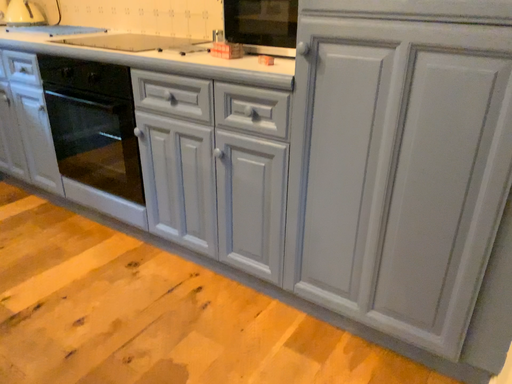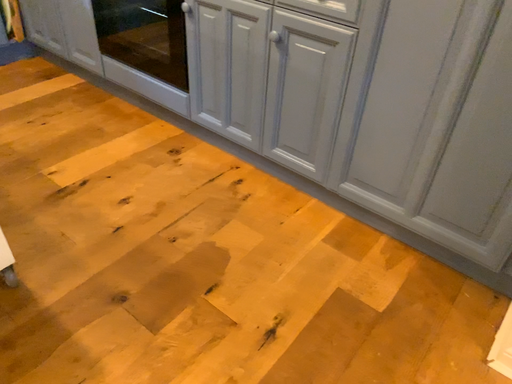
Question: How did the camera likely rotate when shooting the video?

Choices:
 (A) rotated downward
 (B) rotated upward

Answer: (A)